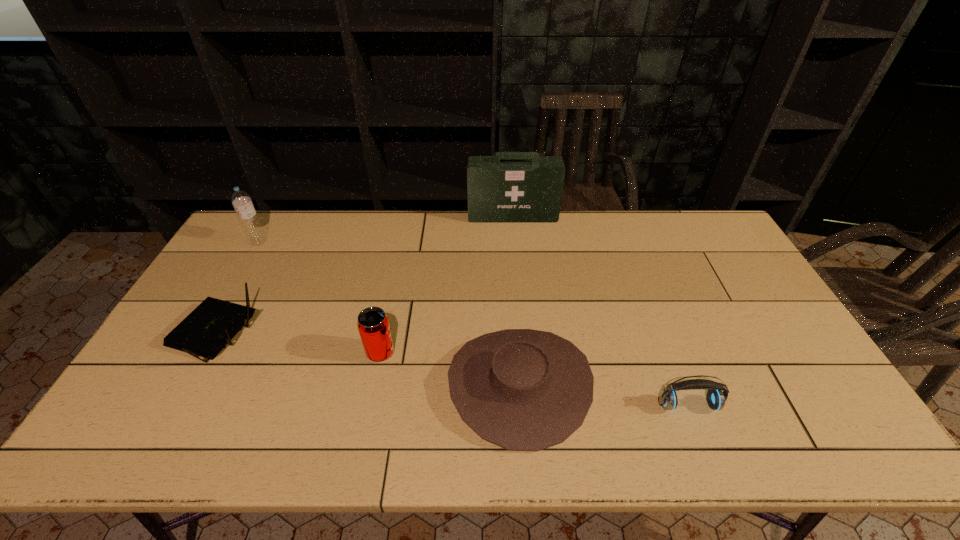
You are a GUI agent. You are given a task and a screenshot of the screen. Output one action in this format:
    pyautogui.click(x=<x>, y=<y>)
    Task: Click on the tallest object
    Image resolution: width=960 pixels, height=540 pixels.
    Given the screenshot: What is the action you would take?
    coord(510,187)

I want to click on the farthest object, so click(x=510, y=187).

Where is `the second farthest object`? The image size is (960, 540). the second farthest object is located at coordinates (241, 200).

Locate an element on the screen. This screenshot has height=540, width=960. the fifth shortest object is located at coordinates coord(241,200).

I want to click on soda can, so click(373, 325).

At what (x,y) coordinates should I click in order to perform the action: click on the fourth shortest object. Please return your answer as a coordinate pair (x, y). Looking at the image, I should click on (373, 325).

Identify the location of headset. This screenshot has height=540, width=960. (716, 399).

Locate an element on the screen. router is located at coordinates (211, 326).

At what (x,y) coordinates should I click in order to perform the action: click on cowboy hat. Please return your answer as a coordinate pair (x, y). Looking at the image, I should click on (x=521, y=389).

The width and height of the screenshot is (960, 540). I want to click on free space located on the front-facing side of the tallest object, so click(520, 295).